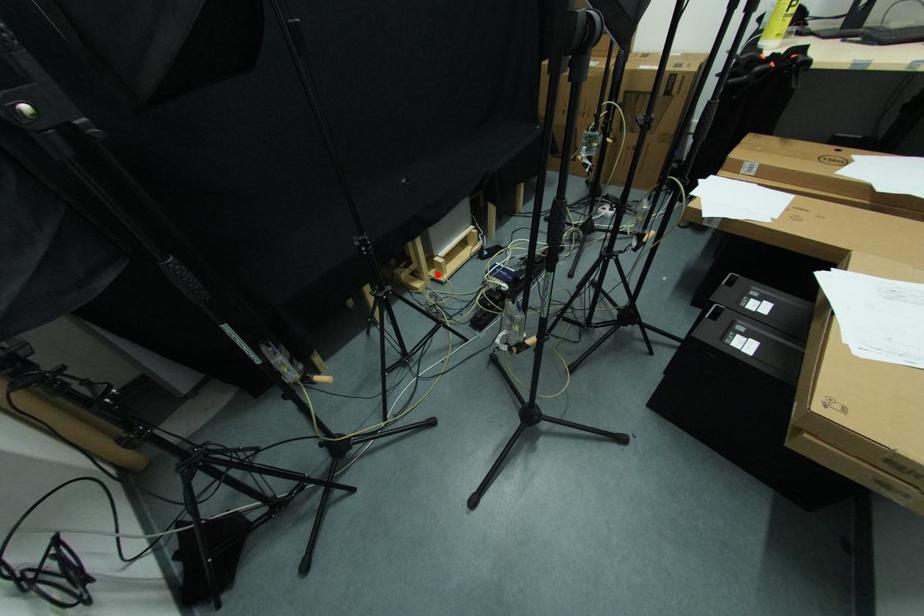
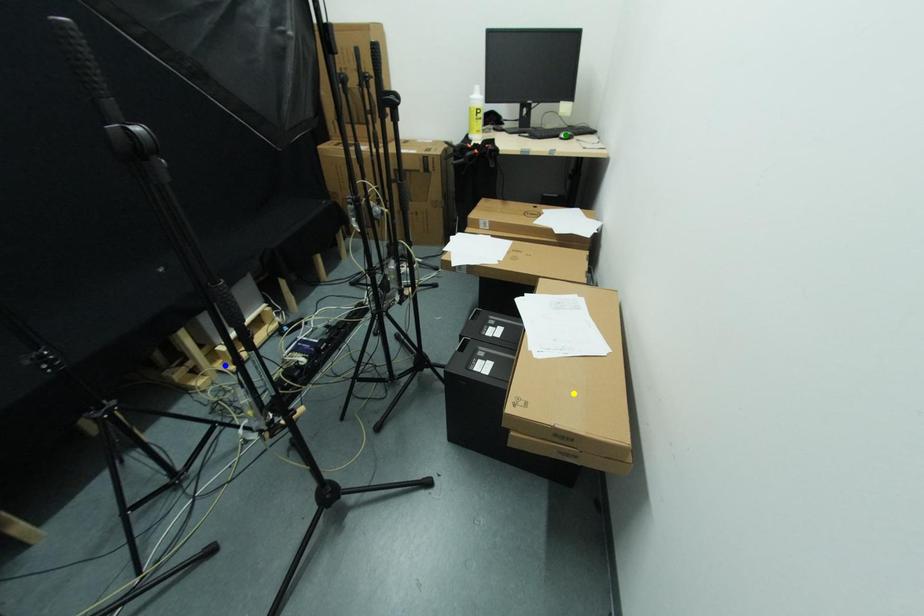
Question: I am providing you with two images of the same scene from different viewpoints. A red point is marked on the first image. You are given multiple points on the second image. Which point in image 2 is actually the same real-world point as the red point in image 1?

Choices:
 (A) green point
 (B) blue point
 (C) yellow point

Answer: (B)